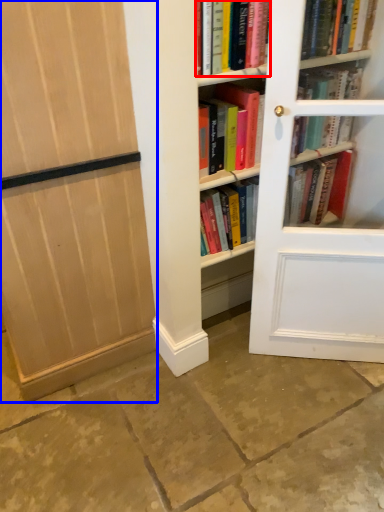
Question: Among these objects, which one is nearest to the camera, book (highlighted by a red box) or door (highlighted by a blue box)?

Choices:
 (A) book
 (B) door

Answer: (B)